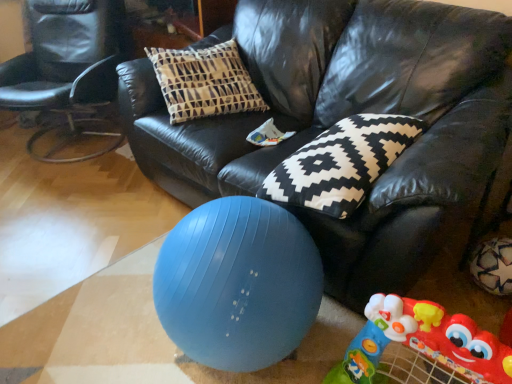
The width and height of the screenshot is (512, 384). In order to click on free region under black leather chair at left (from a real-world perspective) in this screenshot , I will do `click(71, 144)`.